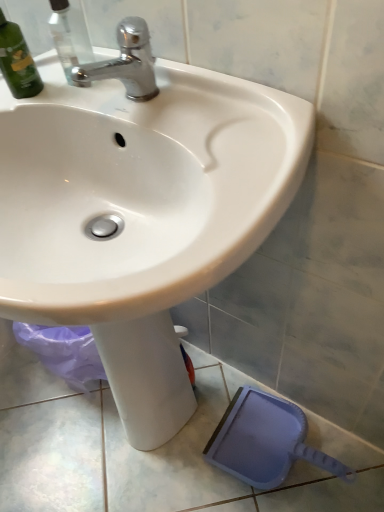
This screenshot has height=512, width=384. Find the location of `vacant space underneath white glossy sink at upper center (from a real-world perspective)`. vacant space underneath white glossy sink at upper center (from a real-world perspective) is located at coordinates (155, 438).